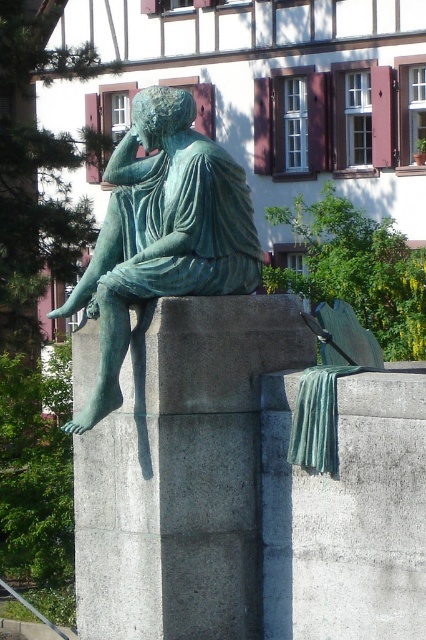
You are standing in front of the bronze statue and want to place a small bouquet of flowers at the base of the green stone pillar at center. Based on the coordinates provided, where exactly should you place the bouquet relative to the statue?

The green stone pillar at center is located at point (181, 472), so you should place the bouquet at those coordinates relative to the statue.

You are an art conservator assessing the statue and pillar. Which object has a greater width between the green stone pillar at center and the green patina bronze statue at center?

The green stone pillar at center has a greater width than the green patina bronze statue at center.

You are standing in front of the bronze statue on the rectangular stone pedestal. There is a point marked at coordinates (181,472). What object is located at that point?

The green stone pillar at center is located at point (181,472).